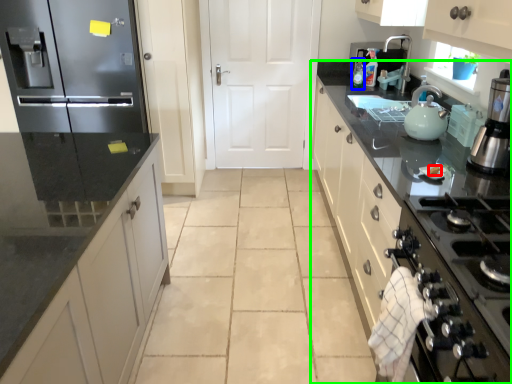
Question: Which object is the farthest from food (highlighted by a red box)? Choose among these: bottle (highlighted by a blue box) or countertop (highlighted by a green box).

Choices:
 (A) bottle
 (B) countertop

Answer: (A)